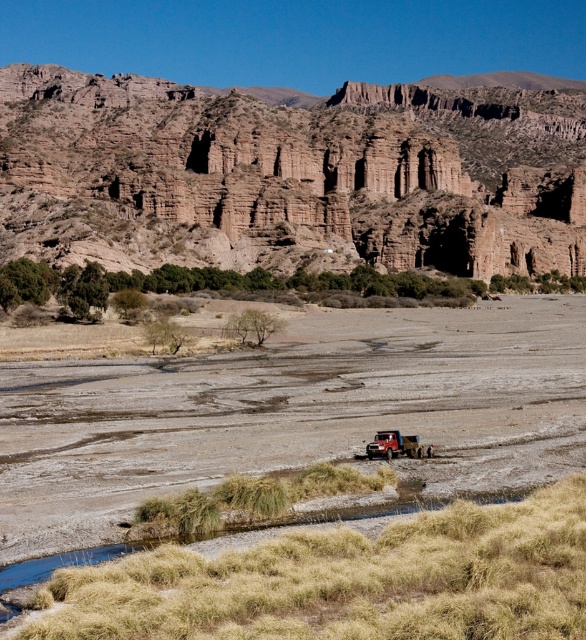
Question: Can you confirm if brown rock formation at upper center is positioned above brown sandy dirt field at center?

Choices:
 (A) no
 (B) yes

Answer: (B)

Question: Which of the following is the closest to the observer?

Choices:
 (A) brown rock formation at upper center
 (B) brushed metal truck at center

Answer: (B)

Question: Where is brown rock formation at upper center located in relation to brushed metal truck at center in the image?

Choices:
 (A) below
 (B) above

Answer: (B)

Question: Does brown rock formation at upper center lie in front of brushed metal truck at center?

Choices:
 (A) no
 (B) yes

Answer: (A)

Question: Which object appears closest to the camera in this image?

Choices:
 (A) brown rock formation at upper center
 (B) brown sandy dirt field at center

Answer: (B)

Question: Which of these objects is positioned closest to the brown rock formation at upper center?

Choices:
 (A) brushed metal truck at center
 (B) brown sandy dirt field at center

Answer: (B)